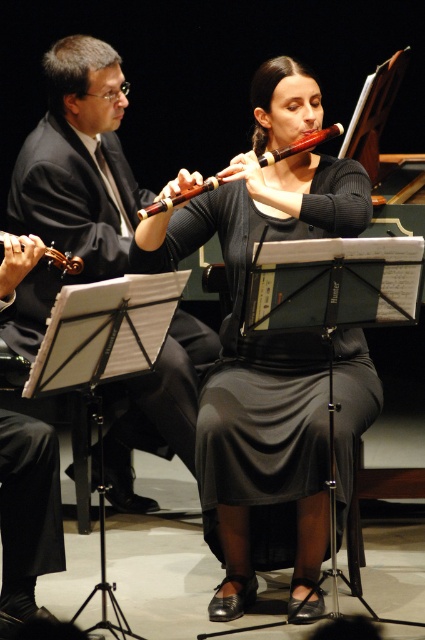
You are a photographer standing at the camera position. You need to capture a closeup shot of the point at coordinate point (272, 157). What is the minimum focal length required to fill the frame with this point?

The distance of point (272, 157) from camera is 2.79 meters. To fill the frame with this point, the minimum focal length required is calculated using the formula f_min. However, since the point is a single coordinate without size, the focal length needed would depend on the sensor size and desired framing. Without additional details, it is not possible to provide an exact value.

You are a stagehand setting up for a classical music performance. You notice the wooden flute at center and the brushed metal violin at left. Which instrument is placed higher on the stage?

The wooden flute at center is positioned over the brushed metal violin at left, so it is placed higher on the stage.